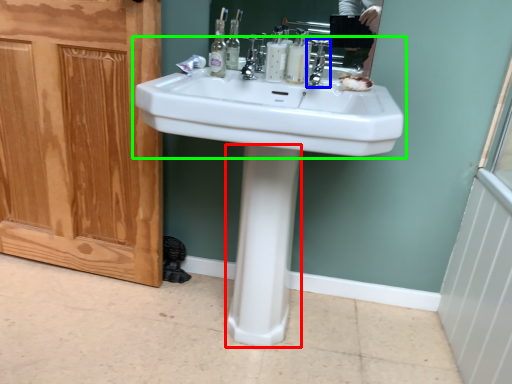
Question: Based on their relative distances, which object is nearer to bidet (highlighted by a red box)? Choose from tap (highlighted by a blue box) and sink (highlighted by a green box).

Choices:
 (A) tap
 (B) sink

Answer: (B)